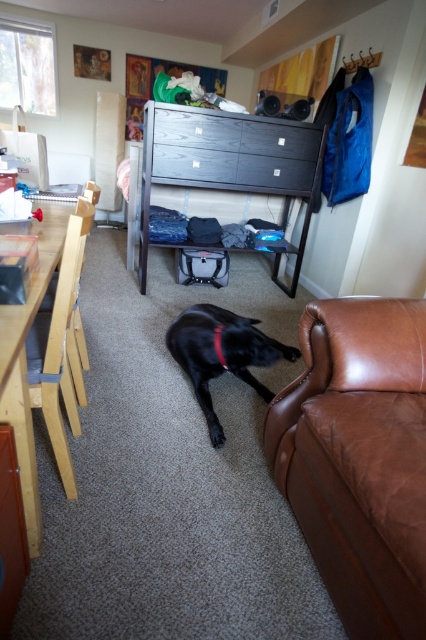
You are standing at the origin point of the room. You want to move to the brown leather couch at lower right. What are the coordinates to reach it?

The coordinates to reach the brown leather couch at lower right are at point (359, 458).

In the scene shown: You are trying to decide whether to place a tall plant next to the matte black drawer at center or the light wood chair at left. Based on their heights, which location would be more stable for the plant?

The light wood chair at left is taller than the matte black drawer at center, so placing the tall plant next to the light wood chair at left would provide a more stable and proportional setup.